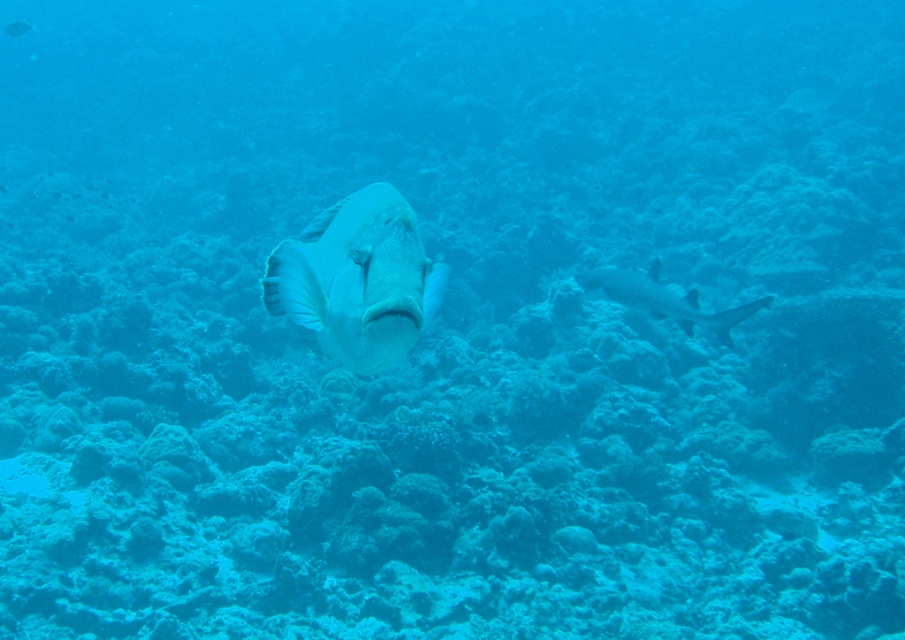
Between white matte fish at center and smooth gray shark at center, which one has more height?

With more height is smooth gray shark at center.

At what (x,y) coordinates should I click in order to perform the action: click on white matte fish at center. Please return your answer as a coordinate pair (x, y). The width and height of the screenshot is (905, 640). Looking at the image, I should click on (357, 280).

Describe the element at coordinates (357, 280) in the screenshot. I see `white matte fish at center` at that location.

You are a GUI agent. You are given a task and a screenshot of the screen. Output one action in this format:
    pyautogui.click(x=<x>, y=<y>)
    Task: Click on the white matte fish at center
    This screenshot has width=905, height=640.
    Given the screenshot: What is the action you would take?
    pyautogui.click(x=357, y=280)